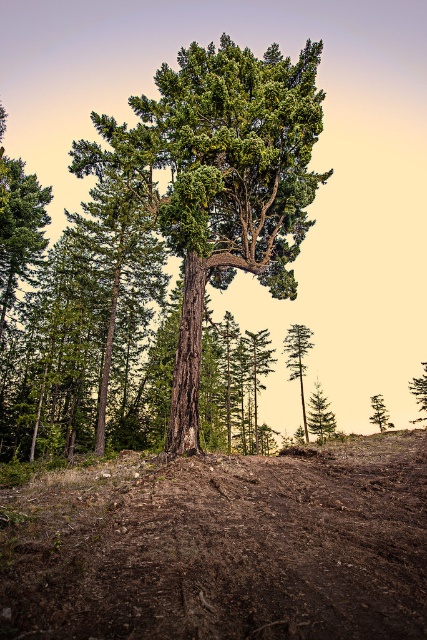
Question: Can you confirm if brown soil at center is thinner than green matte tree at center?

Choices:
 (A) no
 (B) yes

Answer: (A)

Question: Is brown soil at center positioned before green textured tree at center?

Choices:
 (A) no
 (B) yes

Answer: (B)

Question: Based on their relative distances, which object is nearer to the green rough bark tree at right?

Choices:
 (A) green matte tree at upper center
 (B) brown soil at center

Answer: (A)

Question: Which point is closer to the camera?

Choices:
 (A) (312, 392)
 (B) (301, 332)
 (C) (350, 518)

Answer: (C)

Question: Observing the image, what is the correct spatial positioning of green textured tree at center in reference to green matte tree at center?

Choices:
 (A) above
 (B) below

Answer: (A)

Question: Which point is closer to the camera?

Choices:
 (A) green rough bark tree at right
 (B) green matte tree at center
 (C) green matte tree at lower right

Answer: (B)